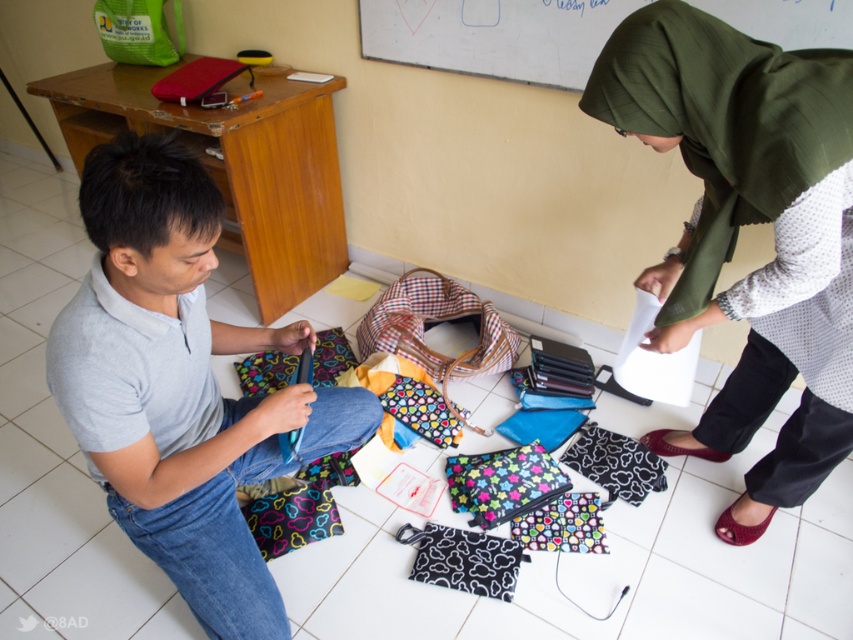
Question: Which point appears closest to the camera in this image?

Choices:
 (A) (680, 67)
 (B) (270, 397)

Answer: (A)

Question: Is green fabric hijab at upper right smaller than gray matte shirt at center?

Choices:
 (A) yes
 (B) no

Answer: (B)

Question: Which of the following is the closest to the observer?

Choices:
 (A) (816, 308)
 (B) (363, 438)

Answer: (A)

Question: In this image, where is green fabric hijab at upper right located relative to gray matte shirt at center?

Choices:
 (A) above
 (B) below

Answer: (A)

Question: Does green fabric hijab at upper right appear on the right side of gray matte shirt at center?

Choices:
 (A) no
 (B) yes

Answer: (B)